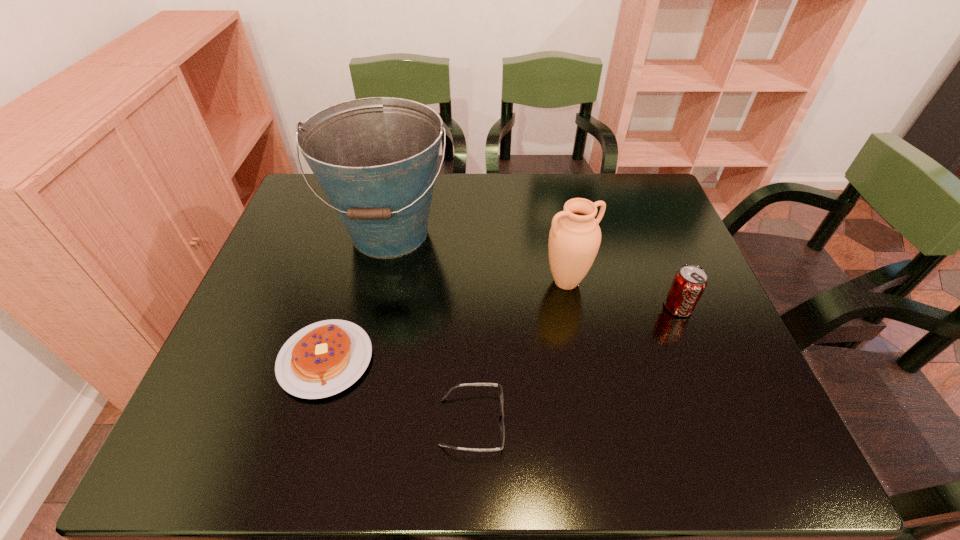
Locate an element on the screen. free location that satisfies the following two spatial constraints: 1. with the handle on opposite sides of the third tallest object; 2. on the right side of the tallest object is located at coordinates click(374, 307).

Where is `vacant area that satisfies the following two spatial constraints: 1. with the handle on opposite sides of the bucket; 2. on the left side of the third shortest object`? Image resolution: width=960 pixels, height=540 pixels. vacant area that satisfies the following two spatial constraints: 1. with the handle on opposite sides of the bucket; 2. on the left side of the third shortest object is located at coordinates (374, 307).